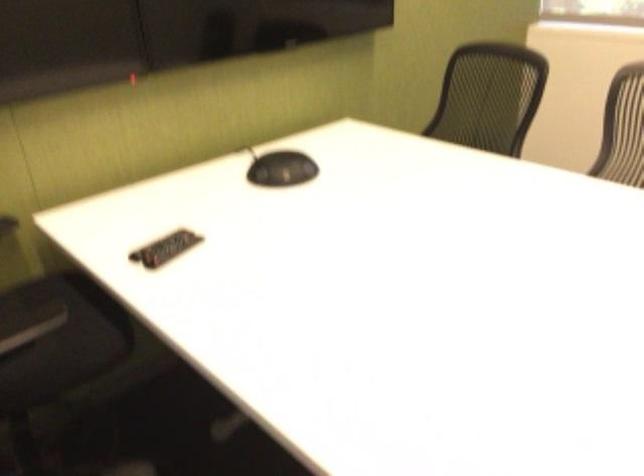
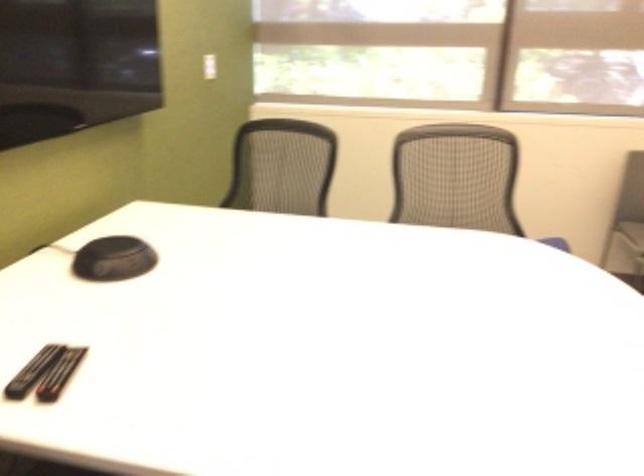
Locate, in the second image, the point that corresponds to point 151,244 in the first image.

(32, 371)